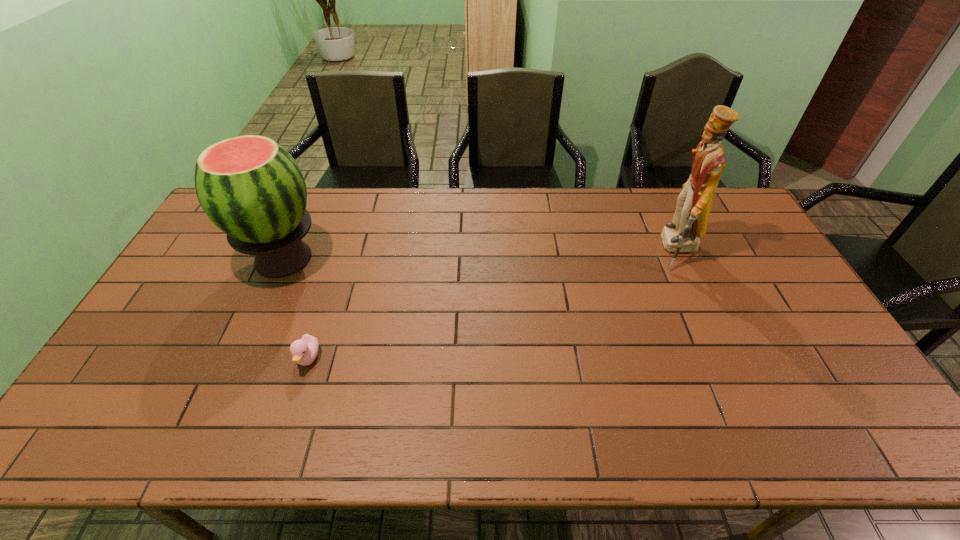
I want to click on vacant region that satisfies the following two spatial constraints: 1. on the front-facing side of the tallest object; 2. on the front-facing side of the shortest object, so click(727, 358).

Identify the location of free space that satisfies the following two spatial constraints: 1. on the front-facing side of the tallest object; 2. on the front-facing side of the shortest object. (727, 358).